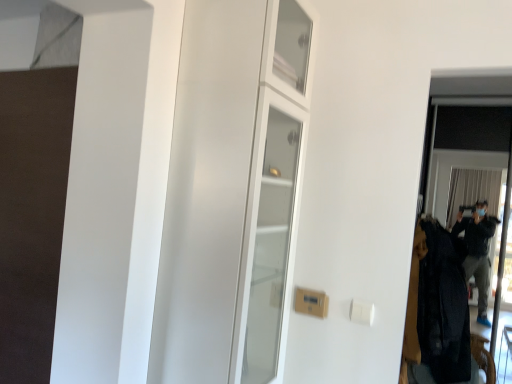
Describe the element at coordinates (233, 192) in the screenshot. I see `white glossy cabinet at center` at that location.

This screenshot has width=512, height=384. What do you see at coordinates (465, 99) in the screenshot?
I see `transparent glass screen door at right` at bounding box center [465, 99].

Image resolution: width=512 pixels, height=384 pixels. I want to click on white glossy cabinet at center, so (x=233, y=192).

From the image's perspective, which object appears higher, transparent glass screen door at right or dark woolen coat at right?

From the image's view, transparent glass screen door at right is above.

Considering their positions, is transparent glass screen door at right located in front of or behind dark woolen coat at right?

transparent glass screen door at right is positioned farther from the viewer than dark woolen coat at right.

In terms of height, does transparent glass screen door at right look taller or shorter compared to dark woolen coat at right?

transparent glass screen door at right is taller than dark woolen coat at right.

This screenshot has width=512, height=384. I want to click on screen door that appears below the white glossy cabinet at center (from the image's perspective), so pyautogui.click(x=465, y=99).

From a real-world perspective, between white glossy cabinet at center and transparent glass screen door at right, who is vertically higher?

white glossy cabinet at center, from a real-world perspective.

Looking at this image, looking at their sizes, would you say white glossy cabinet at center is wider or thinner than transparent glass screen door at right?

white glossy cabinet at center is wider than transparent glass screen door at right.

Does white glossy cabinet at center lie behind transparent glass screen door at right?

No, it is in front of transparent glass screen door at right.

From a real-world perspective, which object rests below the other?

dark woolen coat at right.

From the image's perspective, which is below, dark woolen coat at right or white glossy cabinet at center?

From the image's view, dark woolen coat at right is below.

Are dark woolen coat at right and white glossy cabinet at center making contact?

No, dark woolen coat at right is not beside white glossy cabinet at center.

Based on the photo, in the image, is white glossy cabinet at center on the left side or the right side of dark woolen coat at right?

From the image, it's evident that white glossy cabinet at center is to the left of dark woolen coat at right.

From a real-world perspective, is white glossy cabinet at center over dark woolen coat at right?

Yes.

Does white glossy cabinet at center turn towards dark woolen coat at right?

No, white glossy cabinet at center is not oriented towards dark woolen coat at right.

Can you confirm if dark woolen coat at right is thinner than transparent glass screen door at right?

A: In fact, dark woolen coat at right might be wider than transparent glass screen door at right.

In the scene shown: Considering the positions of objects dark woolen coat at right and transparent glass screen door at right in the image provided, who is more to the right, dark woolen coat at right or transparent glass screen door at right?

transparent glass screen door at right.

Image resolution: width=512 pixels, height=384 pixels. Find the location of `screen door that appears behind the dark woolen coat at right`. screen door that appears behind the dark woolen coat at right is located at coordinates (465, 99).

From the image's perspective, is dark woolen coat at right beneath transparent glass screen door at right?

Yes, from the image's perspective, dark woolen coat at right is below transparent glass screen door at right.

From a real-world perspective, relative to white glossy cabinet at center, is transparent glass screen door at right vertically above or below?

From a real-world perspective, transparent glass screen door at right is physically below white glossy cabinet at center.

Is transparent glass screen door at right in contact with white glossy cabinet at center?

transparent glass screen door at right and white glossy cabinet at center are clearly separated.

Measure the distance from transparent glass screen door at right to white glossy cabinet at center.

The distance of transparent glass screen door at right from white glossy cabinet at center is 5.74 feet.

Where is `clothing lying on the left of transparent glass screen door at right`? The image size is (512, 384). clothing lying on the left of transparent glass screen door at right is located at coordinates (443, 307).

Where is `screen door beneath the white glossy cabinet at center (from a real-world perspective)`? The height and width of the screenshot is (384, 512). screen door beneath the white glossy cabinet at center (from a real-world perspective) is located at coordinates (465, 99).

Which object lies nearer to the anchor point transparent glass screen door at right, dark woolen coat at right or white glossy cabinet at center?

Among the two, dark woolen coat at right is located nearer to transparent glass screen door at right.

When comparing their distances from dark woolen coat at right, does transparent glass screen door at right or white glossy cabinet at center seem closer?

Among the two, transparent glass screen door at right is located nearer to dark woolen coat at right.

When comparing their distances from white glossy cabinet at center, does transparent glass screen door at right or dark woolen coat at right seem closer?

dark woolen coat at right.

From the picture: Considering their positions, is dark woolen coat at right positioned further to white glossy cabinet at center than transparent glass screen door at right?

Among the two, transparent glass screen door at right is located further to white glossy cabinet at center.

Estimate the real-world distances between objects in this image. Which object is closer to dark woolen coat at right, white glossy cabinet at center or transparent glass screen door at right?

transparent glass screen door at right is closer to dark woolen coat at right.

Considering their positions, is white glossy cabinet at center positioned closer to transparent glass screen door at right than dark woolen coat at right?

dark woolen coat at right lies closer to transparent glass screen door at right than the other object.

I want to click on clothing between white glossy cabinet at center and transparent glass screen door at right in the front-back direction, so [443, 307].